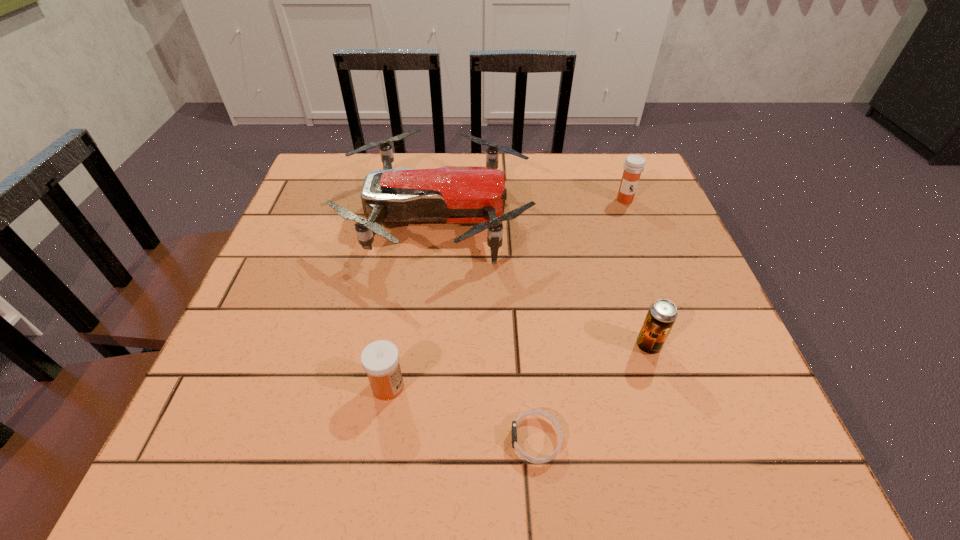
The height and width of the screenshot is (540, 960). I want to click on vacant region located on the label side of the taller medicine, so click(x=666, y=308).

Locate an element on the screen. This screenshot has height=540, width=960. blank space located on the back of the third farthest object is located at coordinates (612, 233).

Locate an element on the screen. free space located on the right of the shorter medicine is located at coordinates (556, 386).

Find the location of a particular element. This screenshot has height=540, width=960. vacant region located 0.290m on the outer surface of the shortest object is located at coordinates (327, 440).

I want to click on vacant area located on the outer surface of the shortest object, so click(x=473, y=440).

The image size is (960, 540). Find the location of `free space located on the outer surface of the shortest object`. free space located on the outer surface of the shortest object is located at coordinates (378, 440).

The height and width of the screenshot is (540, 960). I want to click on drone present at the far edge, so click(x=453, y=194).

Locate an element on the screen. medicine present at the far edge is located at coordinates (634, 165).

The height and width of the screenshot is (540, 960). I want to click on object present at the near edge, so click(x=540, y=412).

Where is `object situated at the left edge`? object situated at the left edge is located at coordinates (453, 194).